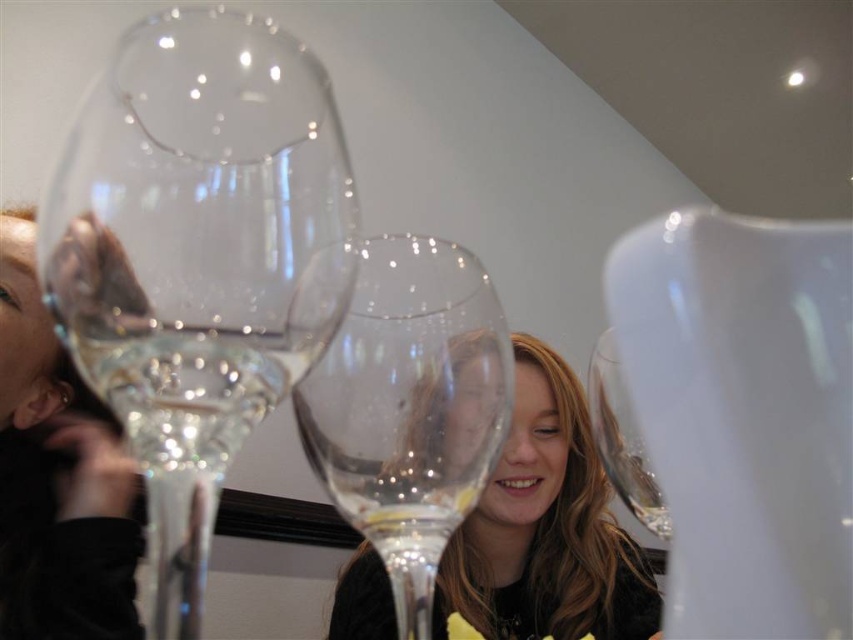
Question: Can you confirm if transparent glass wine glass at center is positioned to the left of clear glass wine glass at center?

Choices:
 (A) yes
 (B) no

Answer: (A)

Question: Does clear glass wine at center have a greater width compared to clear glass wine glass at center?

Choices:
 (A) no
 (B) yes

Answer: (A)

Question: In this image, where is transparent glass wine glass at center located relative to matte glass wine glass at center?

Choices:
 (A) below
 (B) above

Answer: (B)

Question: Estimate the real-world distances between objects in this image. Which object is farther from the transparent glass wine glass at left?

Choices:
 (A) clear glass wine glass at center
 (B) clear glass wine at center
 (C) matte glass wine glass at center

Answer: (C)

Question: Which point is closer to the camera taking this photo?

Choices:
 (A) (543, 525)
 (B) (235, 451)
 (C) (589, 369)
 (D) (167, 312)

Answer: (D)

Question: Estimate the real-world distances between objects in this image. Which object is farther from the transparent glass wine glass at left?

Choices:
 (A) clear glass wine glass at center
 (B) matte glass wine glass at center

Answer: (B)